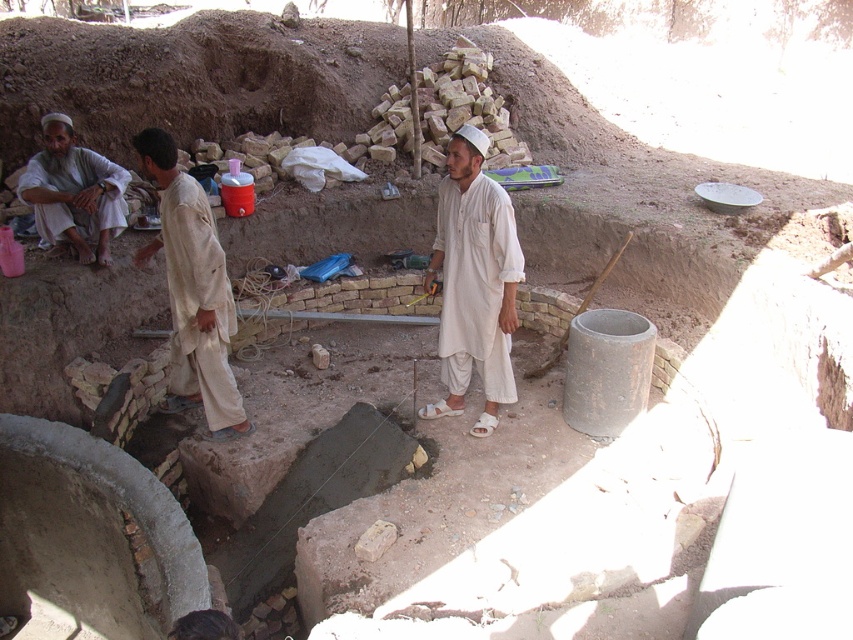
Question: Which point is closer to the camera?

Choices:
 (A) light beige cotton shirt at center
 (B) white cotton kameez at center
 (C) white cotton shirt at left

Answer: (A)

Question: Can you confirm if white cotton kameez at center is wider than light beige cotton shirt at center?

Choices:
 (A) yes
 (B) no

Answer: (B)

Question: Can you confirm if white cotton kameez at center is positioned above white cotton shirt at left?

Choices:
 (A) no
 (B) yes

Answer: (A)

Question: Does white cotton kameez at center appear on the left side of white cotton shirt at left?

Choices:
 (A) no
 (B) yes

Answer: (A)

Question: Which object appears closest to the camera in this image?

Choices:
 (A) light beige cotton shirt at center
 (B) white cotton shirt at left

Answer: (A)

Question: Which of the following is the closest to the observer?

Choices:
 (A) white cotton kameez at center
 (B) light beige cotton shirt at center

Answer: (B)